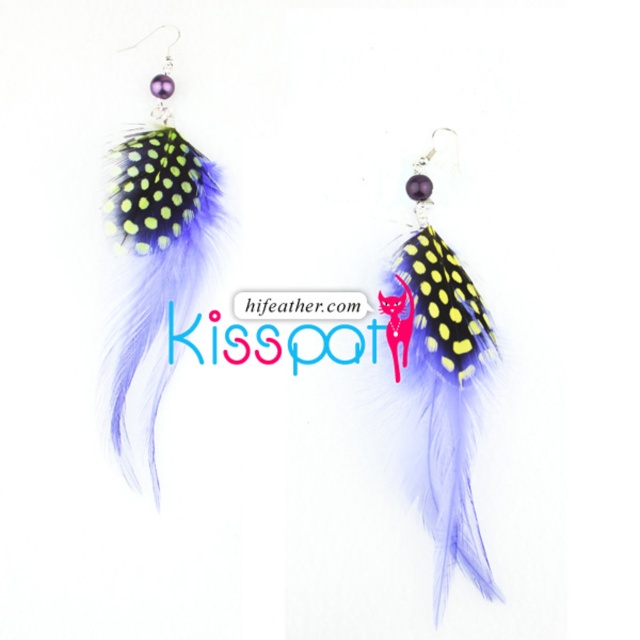
Can you confirm if lavender feather earrings at center is thinner than matte black feather at left?

No.

Does lavender feather earrings at center appear over matte black feather at left?

No, lavender feather earrings at center is not above matte black feather at left.

Locate an element on the screen. lavender feather earrings at center is located at coordinates (442, 380).

I want to click on lavender feather earrings at center, so click(442, 380).